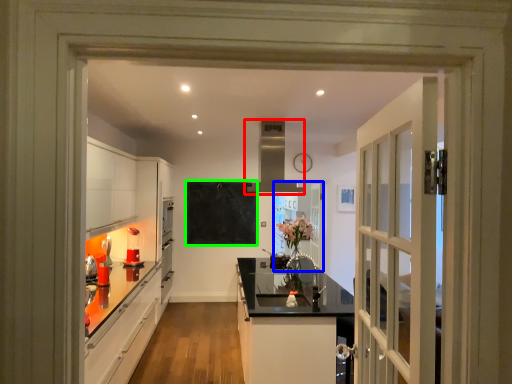
Question: Estimate the real-world distances between objects in this image. Which object is closer to exhaust hood (highlighted by a red box), door (highlighted by a blue box) or bulletin board (highlighted by a green box)?

Choices:
 (A) door
 (B) bulletin board

Answer: (B)